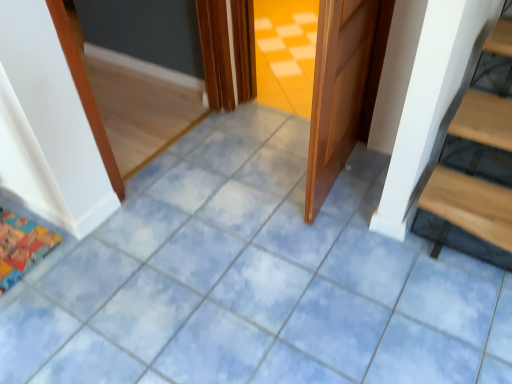
Where is `vacant area that is in front of brown wooden door at center`? vacant area that is in front of brown wooden door at center is located at coordinates (323, 255).